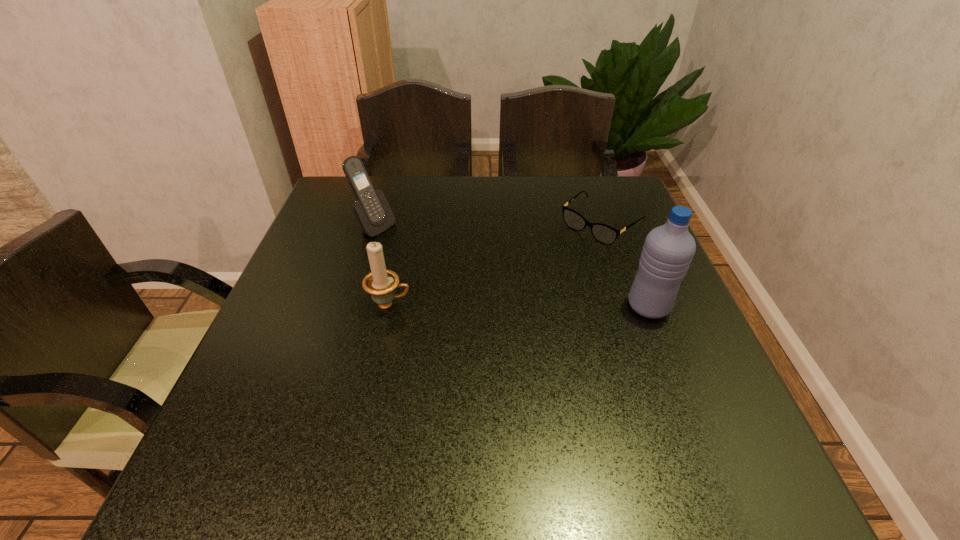
This screenshot has height=540, width=960. I want to click on candle_holder, so click(381, 283).

The width and height of the screenshot is (960, 540). Identify the location of water bottle. (668, 250).

Find the location of a particular element. This screenshot has width=960, height=540. cellular telephone is located at coordinates (372, 211).

Locate an element on the screen. The height and width of the screenshot is (540, 960). the shortest object is located at coordinates (603, 233).

You are a GUI agent. You are given a task and a screenshot of the screen. Output one action in this format:
    pyautogui.click(x=<x>, y=<y>)
    Task: Click on the free location located 0.390m on the handle side of the candle_holder
    The width and height of the screenshot is (960, 540).
    Given the screenshot: What is the action you would take?
    pyautogui.click(x=586, y=305)

Find the location of a particular element. This screenshot has height=540, width=960. vacant space located 0.130m on the left of the water bottle is located at coordinates (568, 306).

The image size is (960, 540). What are the coordinates of `vacant region located on the front-facing side of the cellular telephone` in the screenshot? It's located at (444, 265).

The width and height of the screenshot is (960, 540). In order to click on free space located 0.370m on the front-facing side of the cellular telephone in this screenshot , I will do `click(498, 296)`.

Where is `vacant region located 0.270m on the front-facing side of the cellular telephone`? The height and width of the screenshot is (540, 960). vacant region located 0.270m on the front-facing side of the cellular telephone is located at coordinates (466, 278).

Where is `free region located on the front-facing side of the spectacles`? Image resolution: width=960 pixels, height=540 pixels. free region located on the front-facing side of the spectacles is located at coordinates (473, 327).